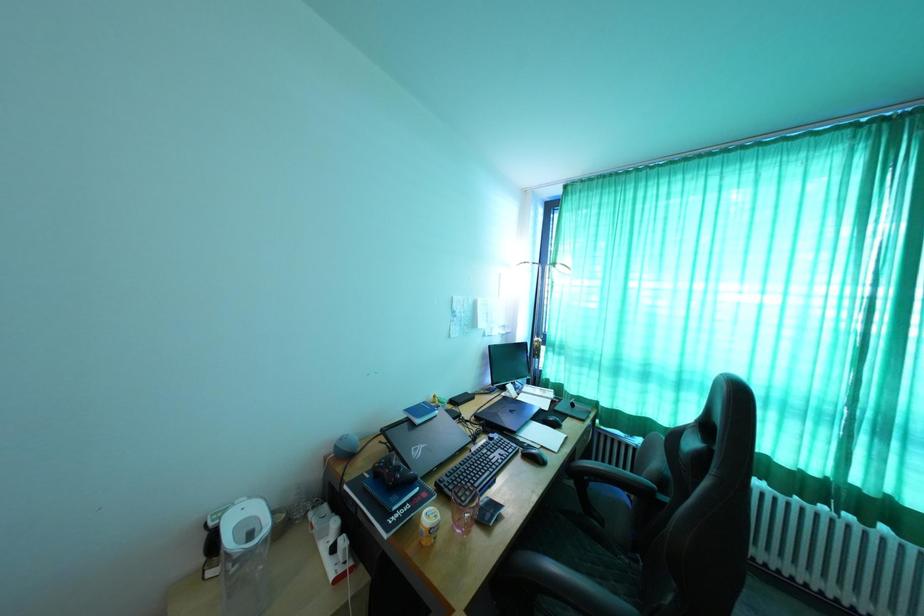
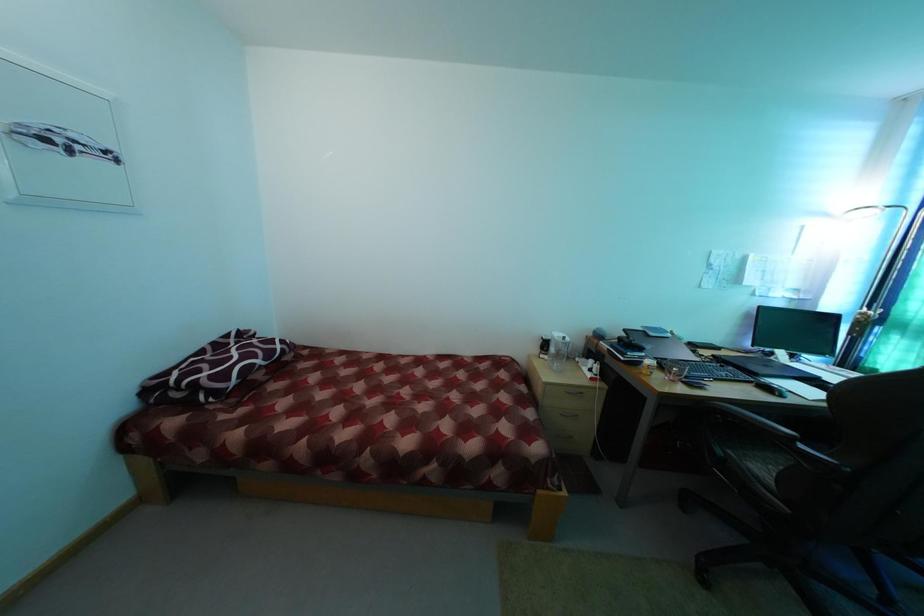
Question: Based on the continuous images, in which direction is the camera rotating? Reply with the corresponding letter.

Choices:
 (A) Left
 (B) Right
 (C) Up
 (D) Down

Answer: (A)